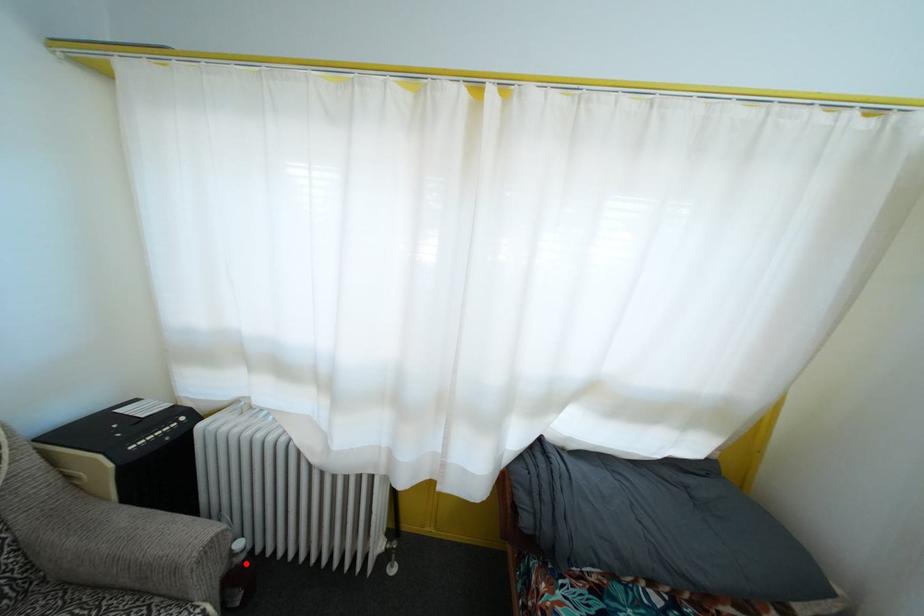
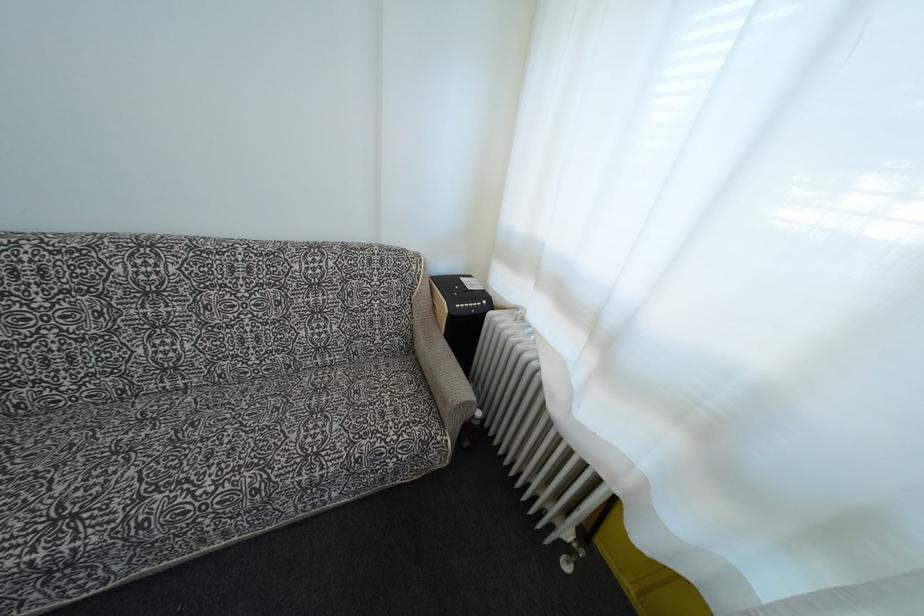
Where in the second image is the point corresponding to the highlighted location from the first image?

(480, 429)